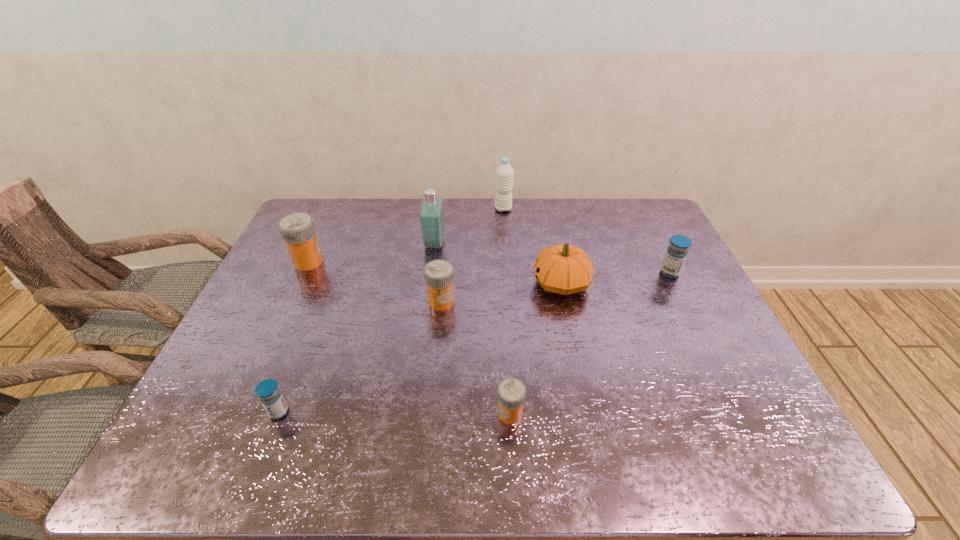
At what (x,y) coordinates should I click in order to perform the action: click on object positioned at the right edge. Please return your answer as a coordinate pair (x, y). Looking at the image, I should click on (676, 253).

What are the coordinates of `free space at the far edge` in the screenshot? It's located at (567, 228).

The image size is (960, 540). I want to click on blank space at the near edge of the desktop, so click(609, 457).

In the image, there is a desktop. Where is `vacant space at the left edge`? This screenshot has width=960, height=540. vacant space at the left edge is located at coordinates pyautogui.click(x=254, y=351).

You are a GUI agent. You are given a task and a screenshot of the screen. Output one action in this format:
    pyautogui.click(x=<x>, y=<y>)
    Task: Click on the free region at the right edge
    Image resolution: width=960 pixels, height=540 pixels.
    Given the screenshot: What is the action you would take?
    pyautogui.click(x=756, y=386)

You are a GUI agent. You are given a task and a screenshot of the screen. Output one action in this format:
    pyautogui.click(x=<x>, y=<y>)
    Task: Click on the vacant area at the near left corner of the desktop
    
    Given the screenshot: What is the action you would take?
    pyautogui.click(x=229, y=454)

Where is `unoccupied area between the leftmost orange medicine and the farthest object`? The width and height of the screenshot is (960, 540). unoccupied area between the leftmost orange medicine and the farthest object is located at coordinates (406, 235).

Find the location of a particular element. The width and height of the screenshot is (960, 540). free space between the second medicine from right to left and the tallest medicine is located at coordinates (409, 338).

The height and width of the screenshot is (540, 960). I want to click on free area in between the tallest medicine and the farther blue medicine, so click(x=489, y=267).

The width and height of the screenshot is (960, 540). I want to click on vacant space in between the water bottle and the bigger blue medicine, so click(587, 241).